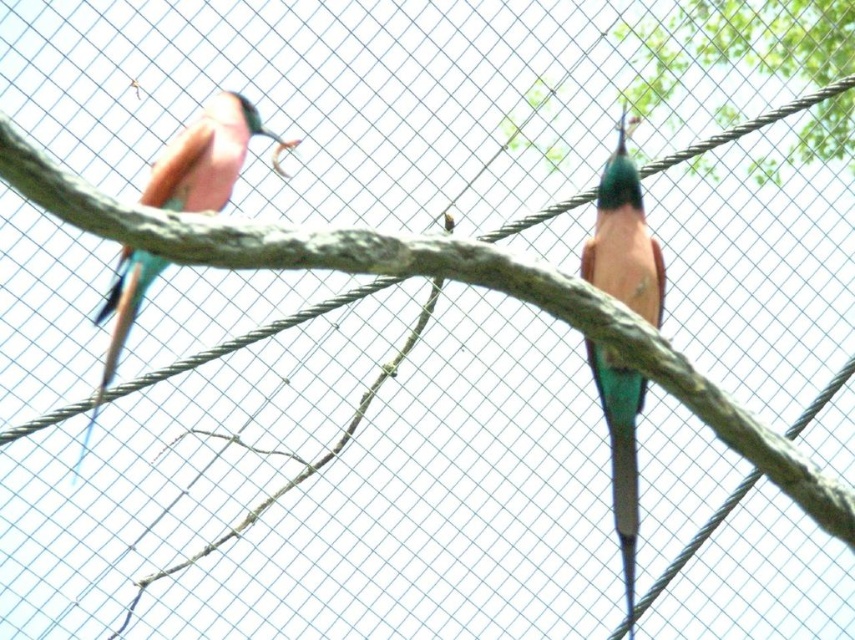
Question: Is teal glossy parrot at center to the right of pink glossy bird at left from the viewer's perspective?

Choices:
 (A) yes
 (B) no

Answer: (A)

Question: Among these points, which one is farthest from the camera?

Choices:
 (A) (211, 208)
 (B) (624, 566)

Answer: (B)

Question: Which object is closer to the camera taking this photo?

Choices:
 (A) pink glossy bird at left
 (B) teal glossy parrot at center

Answer: (B)

Question: Can you confirm if teal glossy parrot at center is smaller than pink glossy bird at left?

Choices:
 (A) yes
 (B) no

Answer: (B)

Question: Does teal glossy parrot at center come in front of pink glossy bird at left?

Choices:
 (A) yes
 (B) no

Answer: (A)

Question: Which point is farther to the camera?

Choices:
 (A) (198, 147)
 (B) (641, 396)

Answer: (B)